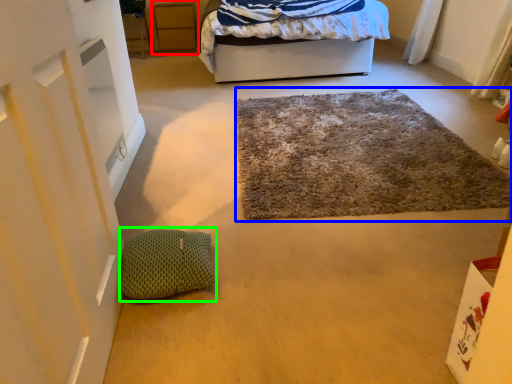
Question: Which object is the closest to the cabinetry (highlighted by a red box)? Choose among these: door (highlighted by a blue box) or pillow (highlighted by a green box).

Choices:
 (A) door
 (B) pillow

Answer: (A)